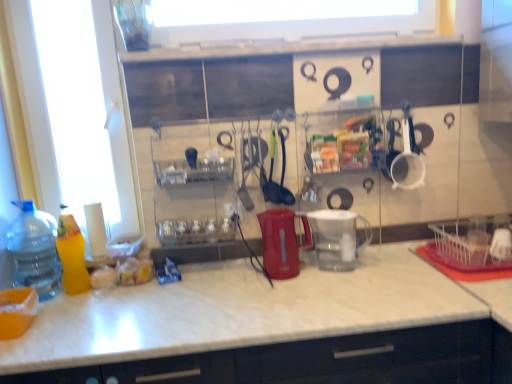
Question: Is matte plastic kettle at center, which ranks as the 1th appliance in left-to-right order, bigger or smaller than transparent plastic bottle at left, which appears as the 1th bottle when viewed from the left?

Choices:
 (A) small
 (B) big

Answer: (A)

Question: From a real-world perspective, is matte plastic kettle at center, arranged as the second appliance when viewed from the right, above or below transparent plastic bottle at left, marked as the second bottle in a right-to-left arrangement?

Choices:
 (A) above
 (B) below

Answer: (B)

Question: Which is nearer to the white marble countertop at center?

Choices:
 (A) transparent plastic bottle at left, marked as the second bottle in a right-to-left arrangement
 (B) matte plastic kettle at center, arranged as the second appliance when viewed from the right
 (C) white plastic cup at upper right, the first tableware in the right-to-left sequence
 (D) transparent plastic pitcher at center, acting as the 1th appliance starting from the right
 (E) yellow plastic bottle at left, acting as the 1th bottle starting from the right

Answer: (B)

Question: Estimate the real-world distances between objects in this image. Which object is closer to the green plastic ladle at center, which is the first tableware in left-to-right order?

Choices:
 (A) yellow plastic bottle at left, acting as the 1th bottle starting from the right
 (B) transparent plastic pitcher at center, which appears as the 2th appliance when viewed from the left
 (C) matte plastic kettle at center, arranged as the second appliance when viewed from the right
 (D) black rubber spatula at center, marked as the 2th tableware in a left-to-right arrangement
 (E) white marble countertop at center

Answer: (D)